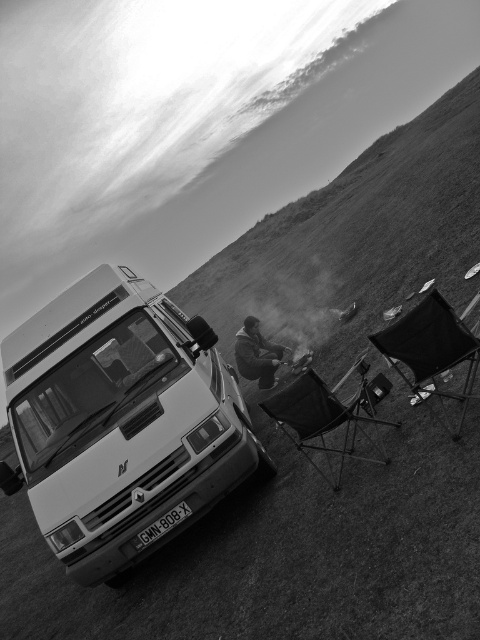
Question: Estimate the real-world distances between objects in this image. Which object is closer to the matte black chair at center?

Choices:
 (A) black fabric folding chair at right
 (B) white glossy van at center
 (C) black plastic license plate at center

Answer: (A)

Question: From the image, what is the correct spatial relationship of white glossy van at center in relation to matte black chair at center?

Choices:
 (A) right
 (B) left

Answer: (B)

Question: Can you confirm if white glossy van at center is bigger than dark fabric jacket at center?

Choices:
 (A) no
 (B) yes

Answer: (B)

Question: Which point is closer to the camera taking this photo?

Choices:
 (A) (278, 397)
 (B) (54, 372)
 (C) (254, 339)

Answer: (A)

Question: Does white glossy van at center have a larger size compared to matte black chair at center?

Choices:
 (A) yes
 (B) no

Answer: (A)

Question: Among these points, which one is nearest to the camera?

Choices:
 (A) (415, 394)
 (B) (242, 376)
 (C) (132, 541)

Answer: (C)